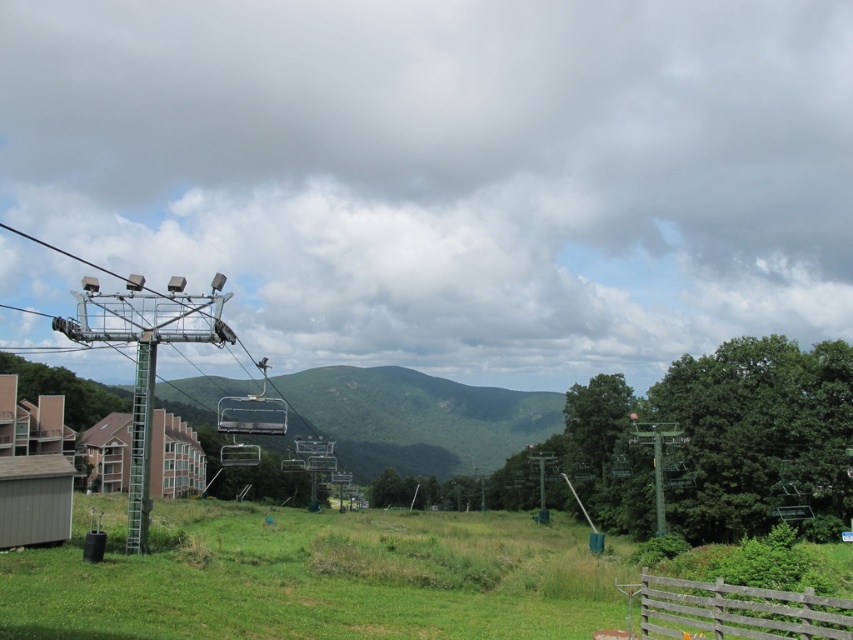
You are a hiker planning to cross the area between the green grassy field at lower center and the green metallic pole at left. Which direction should you head to move from the pole to the field?

To move from the green metallic pole at left to the green grassy field at lower center, you should head to the right since the field is positioned on the right side of the pole.

You are a photographer standing at the center of the scene. You want to take a photo that includes both the wooden fence at lower right and the green metallic pole at left. Which object should you position closer to the edge of the frame to ensure both are in the shot?

Since the wooden fence at lower right is closer to the viewer than the green metallic pole at left, you should position the green metallic pole at left closer to the edge of the frame to ensure both are included in the photo.